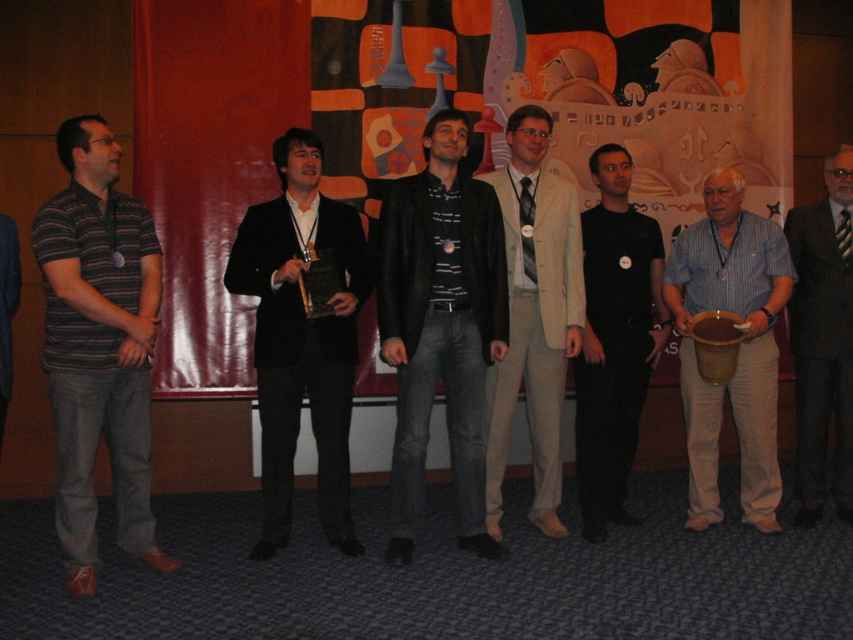
Question: Among these points, which one is farthest from the camera?

Choices:
 (A) (340, 218)
 (B) (486, 209)
 (C) (569, 339)

Answer: (C)

Question: Can you confirm if dark gray denim jeans at center is positioned above black matte suit at center?

Choices:
 (A) yes
 (B) no

Answer: (A)

Question: Which of the following is the farthest from the observer?

Choices:
 (A) (614, 268)
 (B) (479, 364)
 (C) (100, 196)
 (D) (769, 317)

Answer: (A)

Question: Among these points, which one is nearest to the camera?

Choices:
 (A) (738, 392)
 (B) (532, 326)
 (C) (625, 326)

Answer: (B)

Question: Is dark gray denim jeans at center below black matte shirt at center?

Choices:
 (A) yes
 (B) no

Answer: (B)

Question: Does blue striped shirt at right have a larger size compared to black matte shirt at center?

Choices:
 (A) yes
 (B) no

Answer: (B)